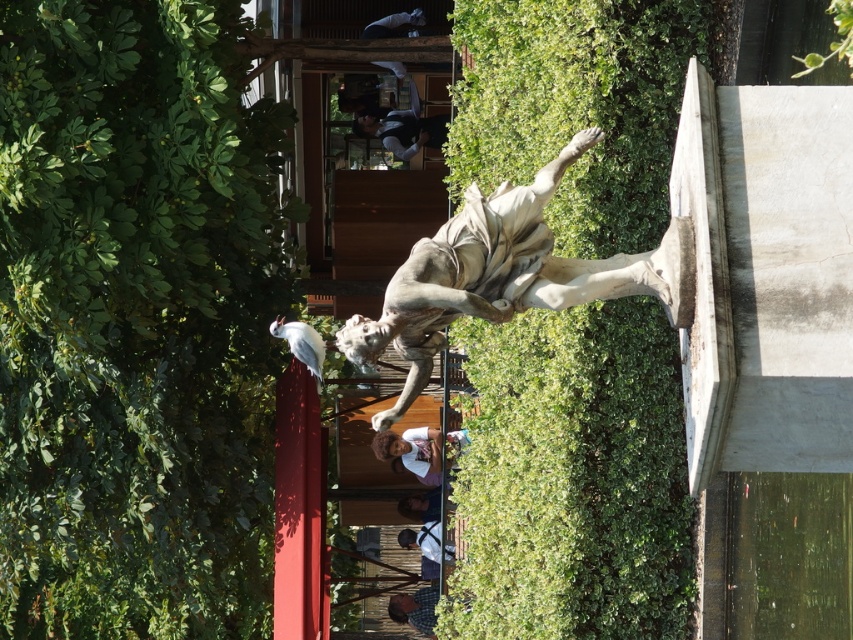
Question: Is green leafy hedge at upper left positioned behind dark blue shirt at center?

Choices:
 (A) no
 (B) yes

Answer: (A)

Question: Which object appears farthest from the camera in this image?

Choices:
 (A) smooth brown hair at center
 (B) white matte shirt at center
 (C) white marble statue at center
 (D) dark blue shirt at center

Answer: (A)

Question: Does green leafy hedge at upper left have a smaller size compared to smooth brown hair at center?

Choices:
 (A) yes
 (B) no

Answer: (B)

Question: Which object appears farthest from the camera in this image?

Choices:
 (A) green leafy hedge at center
 (B) white marble statue at center
 (C) green leafy hedge at upper left
 (D) white matte shirt at center

Answer: (D)

Question: Which of the following is the farthest from the observer?

Choices:
 (A) green leafy hedge at center
 (B) white marble statue at center
 (C) dark blue shirt at center
 (D) white matte shirt at center

Answer: (C)

Question: Is green leafy hedge at center to the left of white matte shirt at center from the viewer's perspective?

Choices:
 (A) yes
 (B) no

Answer: (B)